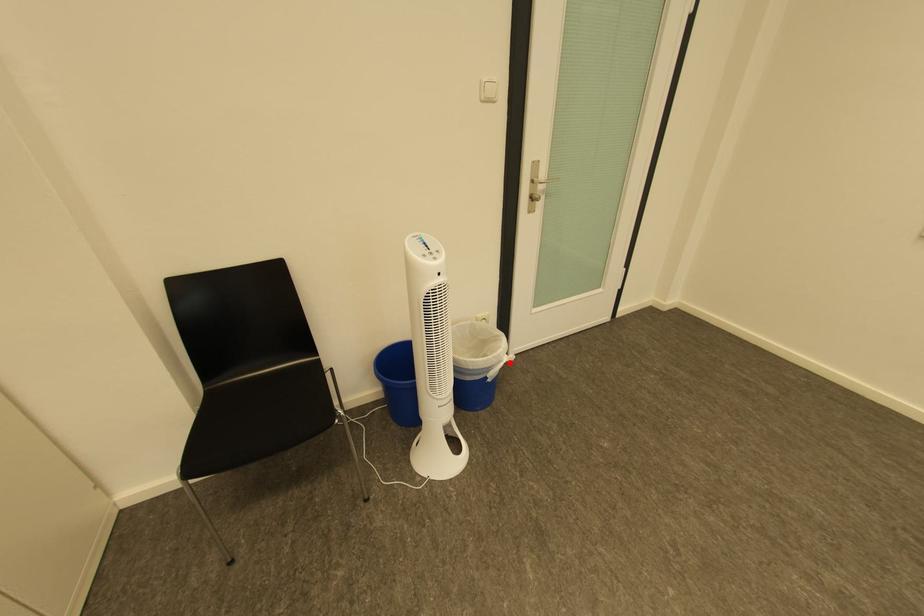
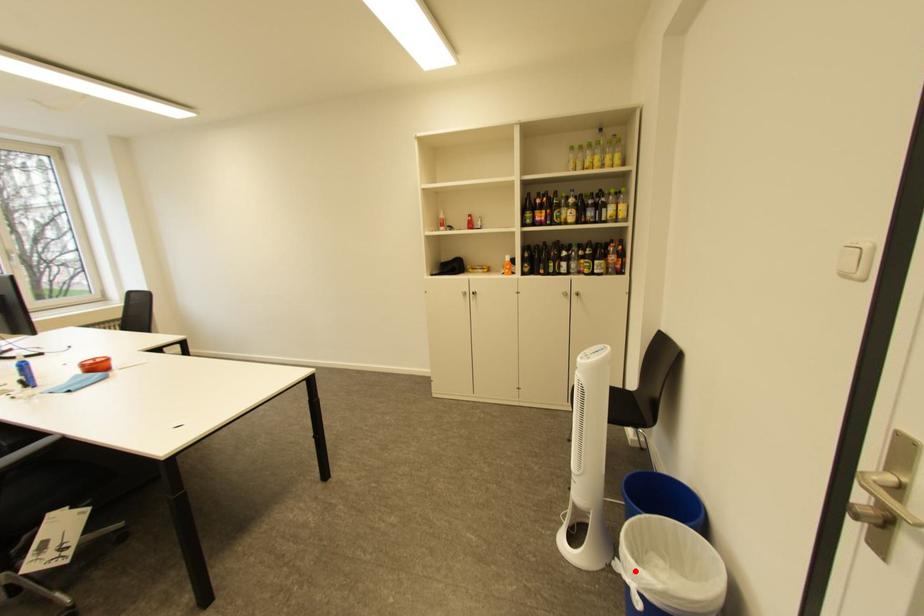
I am providing you with two images of the same scene from different viewpoints. A red point is marked on the first image and another point is marked on the second image. Are the points marked in image1 and image2 representing the same 3D position?

Yes